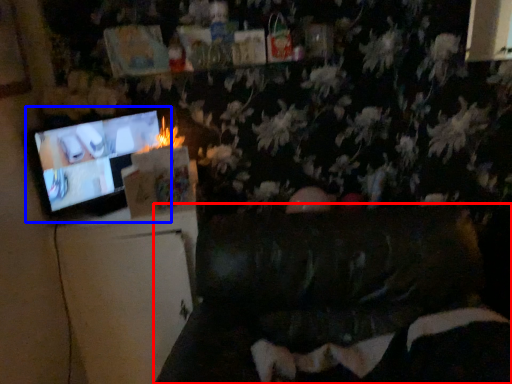
Question: Which of the following is the farthest to the observer, furniture (highlighted by a red box) or television (highlighted by a blue box)?

Choices:
 (A) furniture
 (B) television

Answer: (B)